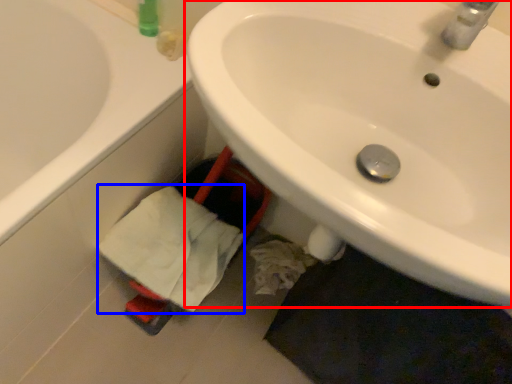
Question: Which point is closer to the camera, sink (highlighted by a red box) or bath towel (highlighted by a blue box)?

Choices:
 (A) sink
 (B) bath towel

Answer: (A)